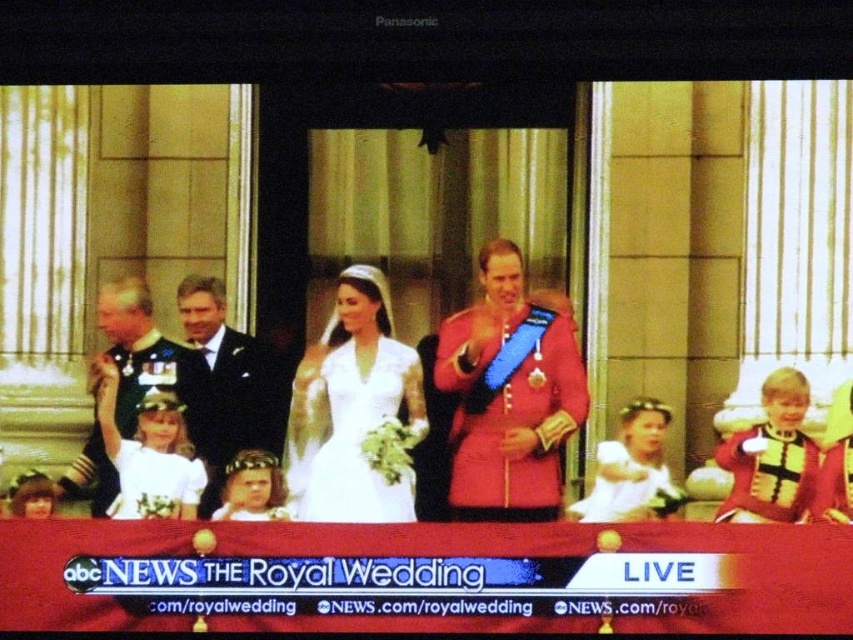
Looking at this image, does shiny red coat at center come in front of shiny silver uniform at left?

Yes.

From the picture: How distant is shiny red coat at center from shiny silver uniform at left?

They are 26.82 feet apart.

Who is more distant from viewer, (534, 340) or (83, 490)?

The point (83, 490) is behind.

What are the coordinates of `shiny red coat at center` in the screenshot? It's located at (509, 394).

Does shiny red coat at center have a lesser height compared to white satin dress at center?

Incorrect, shiny red coat at center's height does not fall short of white satin dress at center's.

Can you confirm if shiny red coat at center is positioned above white satin dress at center?

Correct, shiny red coat at center is located above white satin dress at center.

Between point (518, 481) and point (393, 340), which one is positioned in front?

Point (518, 481) is in front.

Locate an element on the screen. shiny red coat at center is located at coordinates (509, 394).

Is white satin dress at center bigger than shiny silver uniform at left?

Incorrect, white satin dress at center is not larger than shiny silver uniform at left.

The image size is (853, 640). Describe the element at coordinates (352, 408) in the screenshot. I see `white satin dress at center` at that location.

Where is `white satin dress at center`? white satin dress at center is located at coordinates (352, 408).